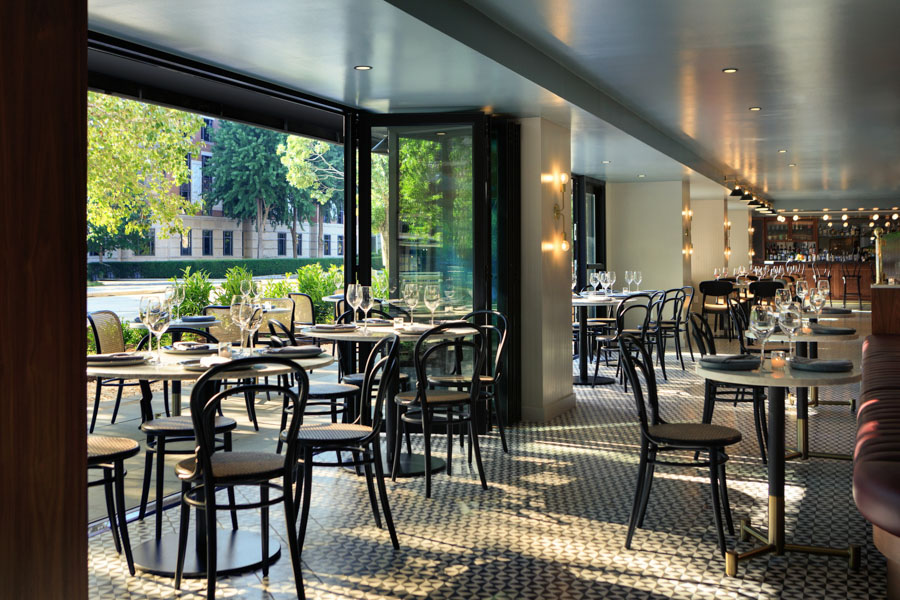
Where is `light`? Image resolution: width=900 pixels, height=600 pixels. light is located at coordinates coord(364,68), coord(732,70).